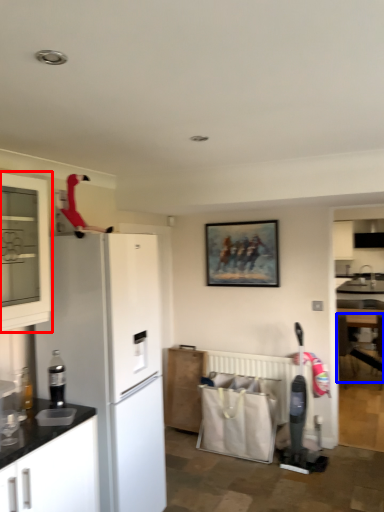
Question: Among these objects, which one is nearest to the camera, cabinetry (highlighted by a red box) or armchair (highlighted by a blue box)?

Choices:
 (A) cabinetry
 (B) armchair

Answer: (A)